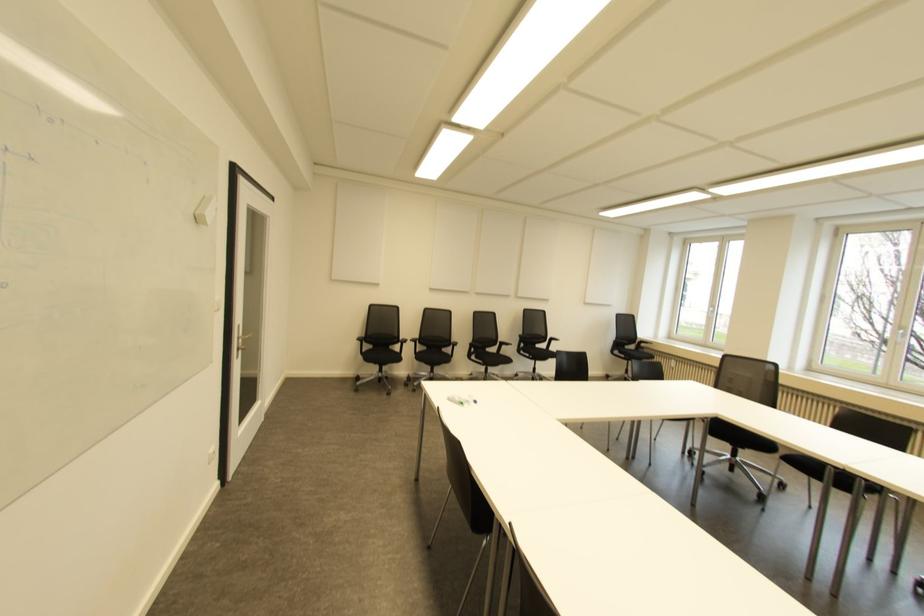
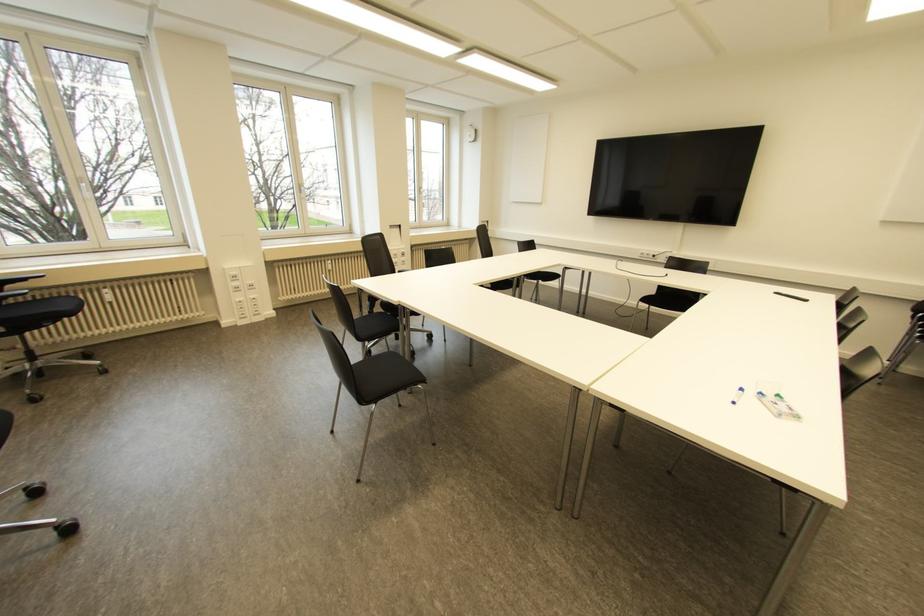
Where in the second image is the point corresponding to pixel 475 400 from the first image?

(739, 390)